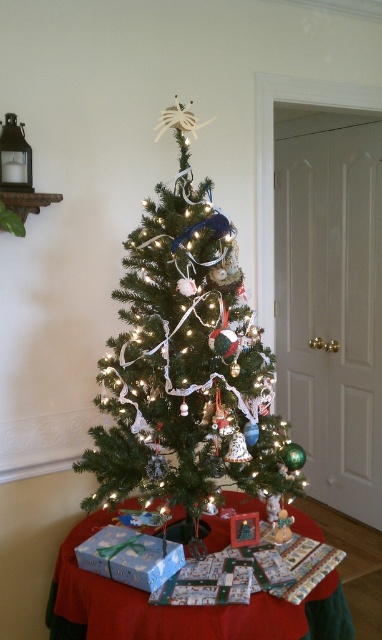
You are planning to place a new ornament on the green matte christmas tree at center and the wrapping paper at lower center. Which object will the ornament fit better in terms of size?

The green matte christmas tree at center has a larger size compared to the wrapping paper at lower center, so the ornament will fit better on the green matte christmas tree at center.

You are standing in the living room looking at the green matte christmas tree at center. What are the coordinates of the tree?

The green matte christmas tree at center is located at coordinates (187, 362).

You are a guest at a Christmas party and want to grab a gift from the wrapping paper at lower center. Can you easily reach it without moving the green matte christmas tree at center?

The wrapping paper at lower center is behind the green matte christmas tree at center, so it might not be easily accessible without moving the tree.